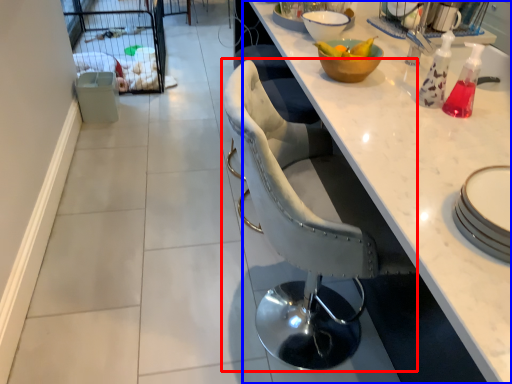
Question: Which of the following is the farthest to the observer, chair (highlighted by a red box) or countertop (highlighted by a blue box)?

Choices:
 (A) chair
 (B) countertop

Answer: (B)